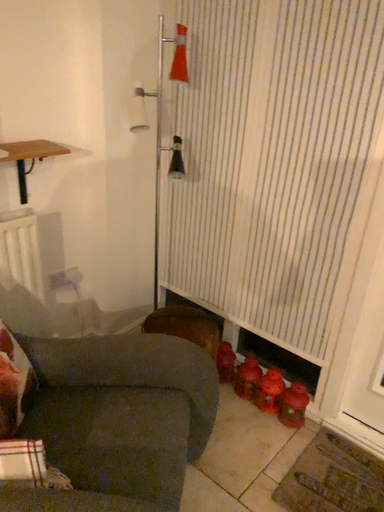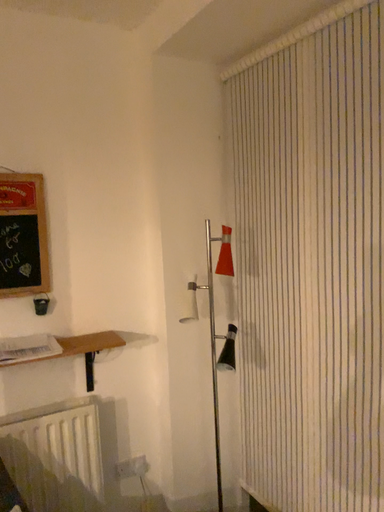
Question: How did the camera likely rotate when shooting the video?

Choices:
 (A) rotated left
 (B) rotated right

Answer: (A)